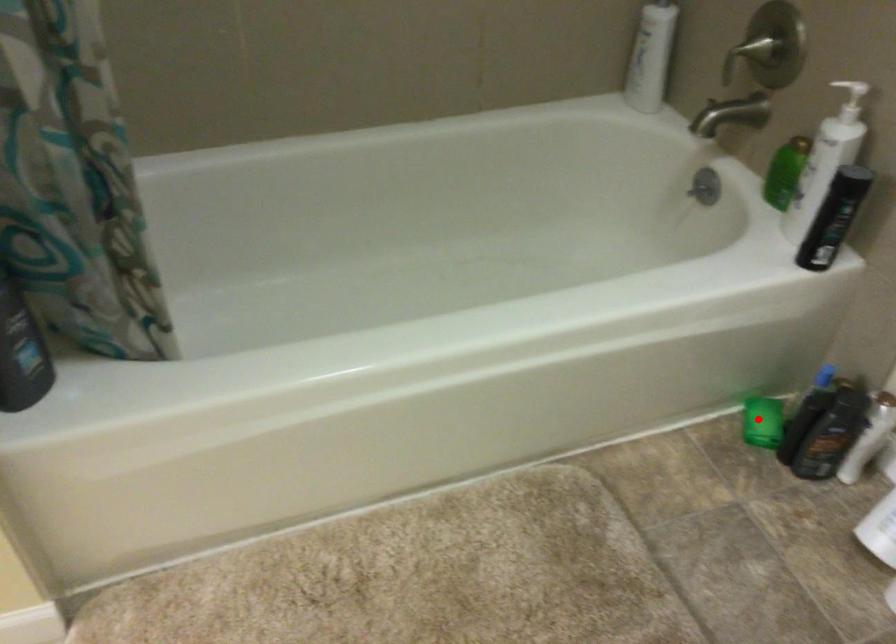
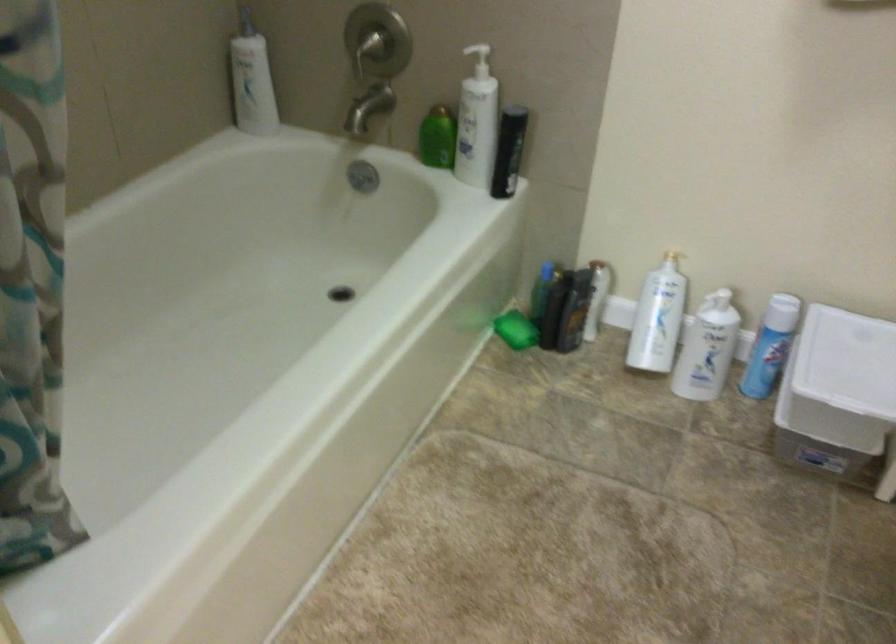
Where in the second image is the point corresponding to the highlighted location from the first image?

(515, 328)